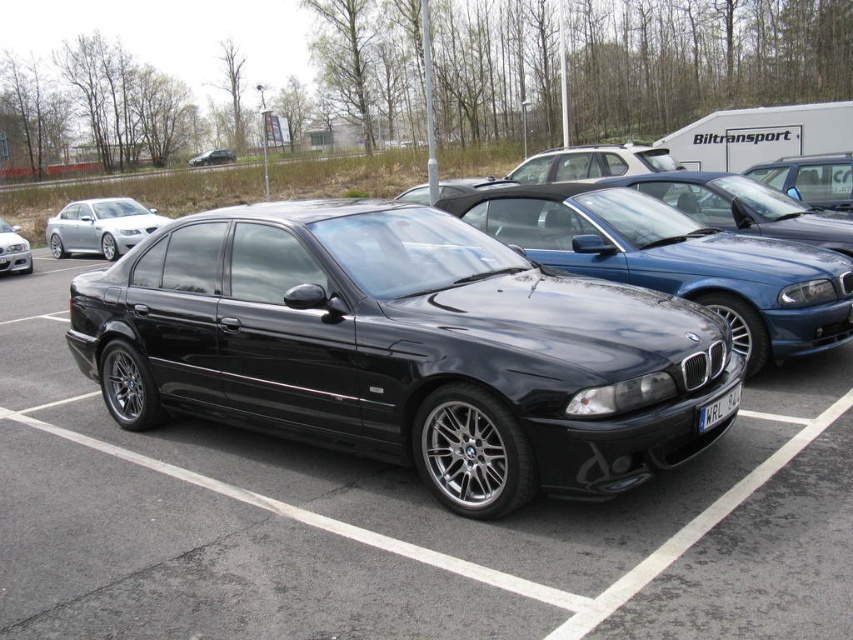
Question: Is glossy black sedan at center thinner than glossy black car at center?

Choices:
 (A) no
 (B) yes

Answer: (A)

Question: Which is nearer to the glossy black car at center?

Choices:
 (A) white plastic license plate at center
 (B) matte black sedan at left
 (C) matte black sedan at center

Answer: (A)

Question: Which of the following is the farthest from the observer?

Choices:
 (A) (171, 237)
 (B) (100, 227)
 (C) (711, 289)

Answer: (B)

Question: Which point is farther from the camera taking this photo?

Choices:
 (A) (827, 262)
 (B) (711, 417)

Answer: (A)

Question: Can you confirm if glossy black sedan at center is positioned below glossy black car at center?

Choices:
 (A) no
 (B) yes

Answer: (B)

Question: Does matte black sedan at left have a lesser width compared to white plastic license plate at center?

Choices:
 (A) yes
 (B) no

Answer: (A)